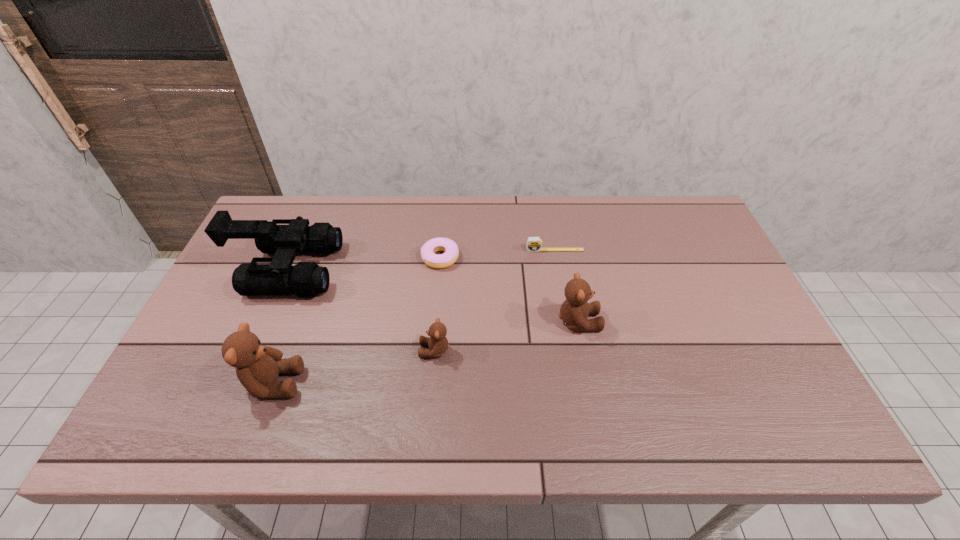
Identify the location of vacant space at the far edge. (567, 206).

Image resolution: width=960 pixels, height=540 pixels. I want to click on vacant space at the near edge of the desktop, so (x=623, y=392).

The width and height of the screenshot is (960, 540). I want to click on free space at the right edge of the desktop, so click(x=731, y=328).

Find the location of a particular element. free space at the far left corner is located at coordinates (279, 206).

Locate an element on the screen. This screenshot has width=960, height=540. vacant space at the near right corner of the desktop is located at coordinates (784, 400).

I want to click on unoccupied area between the second teddy bear from right to left and the binoculars, so click(x=361, y=310).

At what (x,y) coordinates should I click in order to perform the action: click on vacant point located between the second tallest teddy bear and the doughnut. Please return your answer as a coordinate pair (x, y). The image size is (960, 540). Looking at the image, I should click on (509, 289).

The image size is (960, 540). Find the location of `free space between the third shortest object and the tape measure`. free space between the third shortest object and the tape measure is located at coordinates (494, 300).

Identify the location of vacant space that's between the farthest teddy bear and the binoculars. This screenshot has height=540, width=960. tap(432, 295).

Locate an element on the screen. free space between the doughnut and the fourth shortest object is located at coordinates (509, 289).